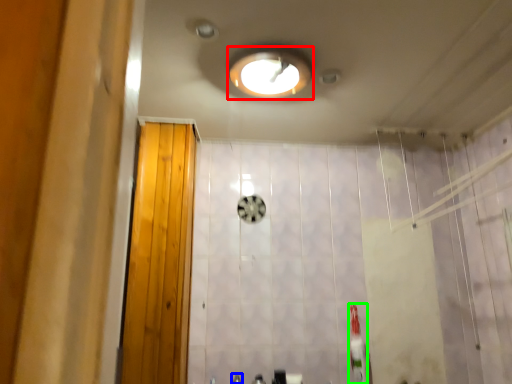
Question: Considering the real-world distances, which object is farthest from light fixture (highlighted by a red box)? faucet (highlighted by a blue box) or toothbrush (highlighted by a green box)?

Choices:
 (A) faucet
 (B) toothbrush

Answer: (A)